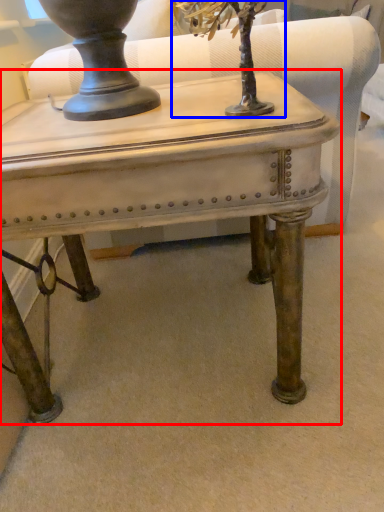
Question: Which of the following is the closest to the observer, table (highlighted by a red box) or tree (highlighted by a blue box)?

Choices:
 (A) table
 (B) tree

Answer: (B)